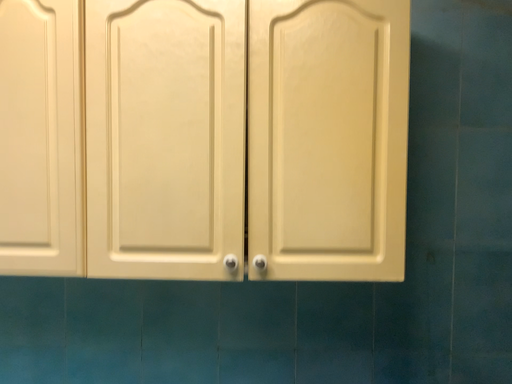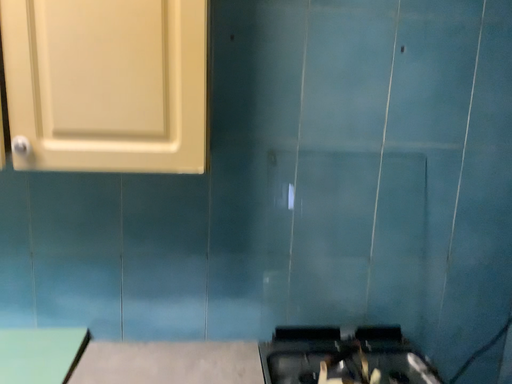
Question: Which way did the camera rotate in the video?

Choices:
 (A) rotated upward
 (B) rotated downward

Answer: (B)